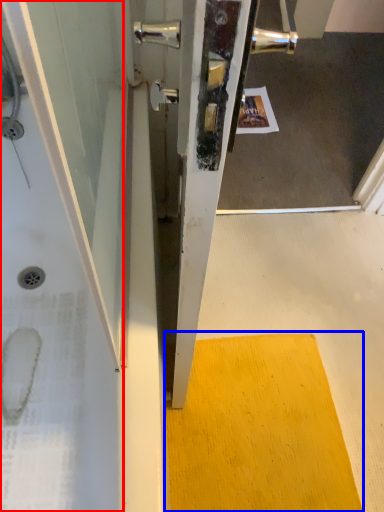
Question: Among these objects, which one is farthest to the camera, bath (highlighted by a red box) or doormat (highlighted by a blue box)?

Choices:
 (A) bath
 (B) doormat

Answer: (B)